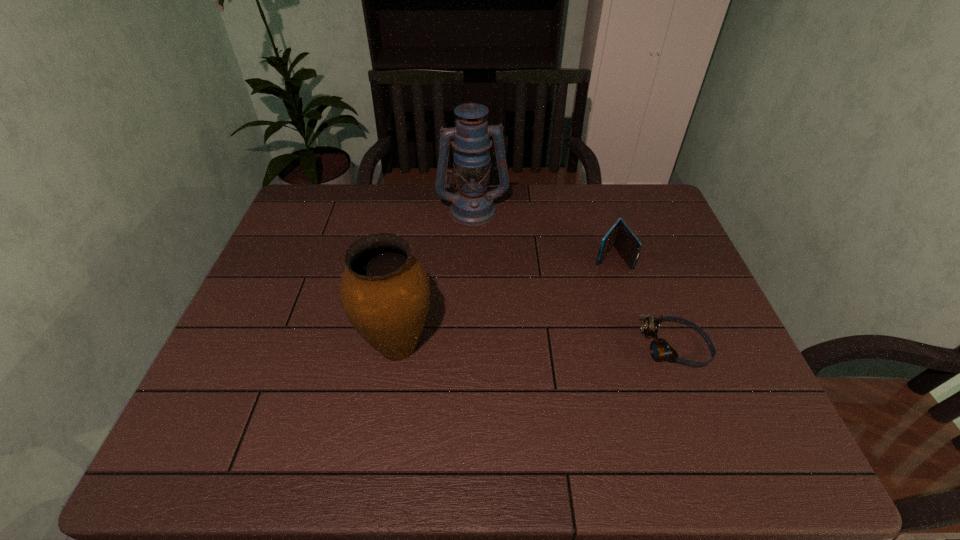
This screenshot has height=540, width=960. What are the coordinates of `free space between the third nearest object and the tallest object` in the screenshot? It's located at (542, 233).

Image resolution: width=960 pixels, height=540 pixels. In order to click on free space between the third tallest object and the urn in this screenshot , I will do `click(504, 301)`.

Where is `free point between the urn and the lantern`? free point between the urn and the lantern is located at coordinates (435, 278).

Image resolution: width=960 pixels, height=540 pixels. I want to click on object that stands as the second closest to the tallest object, so click(385, 292).

Where is `the third closest object to the tallest object`? This screenshot has height=540, width=960. the third closest object to the tallest object is located at coordinates (660, 349).

Where is `free point that satisfies the following two spatial constraints: 1. on the back side of the farthest object; 2. on the left side of the urn`? The height and width of the screenshot is (540, 960). free point that satisfies the following two spatial constraints: 1. on the back side of the farthest object; 2. on the left side of the urn is located at coordinates (420, 210).

Locate an element on the screen. This screenshot has width=960, height=540. vacant space that satisfies the following two spatial constraints: 1. on the front side of the tallest object; 2. on the right side of the third tallest object is located at coordinates (472, 257).

Image resolution: width=960 pixels, height=540 pixels. Find the location of `vacant region that satisfies the following two spatial constraints: 1. on the front side of the third nearest object; 2. on the left side of the lantern`. vacant region that satisfies the following two spatial constraints: 1. on the front side of the third nearest object; 2. on the left side of the lantern is located at coordinates (472, 257).

I want to click on free space that satisfies the following two spatial constraints: 1. on the front side of the goggles; 2. through the lenses of the third tallest object, so pos(639,347).